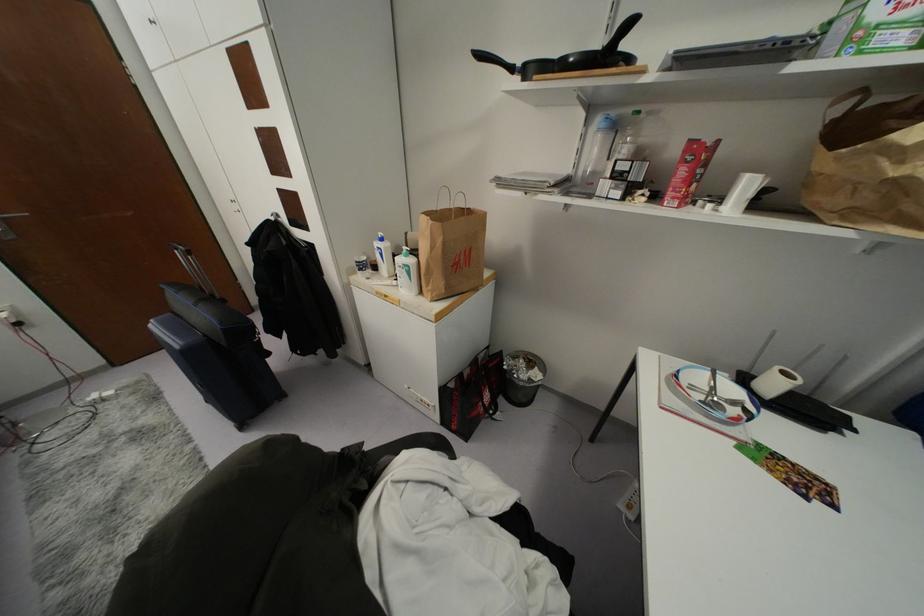
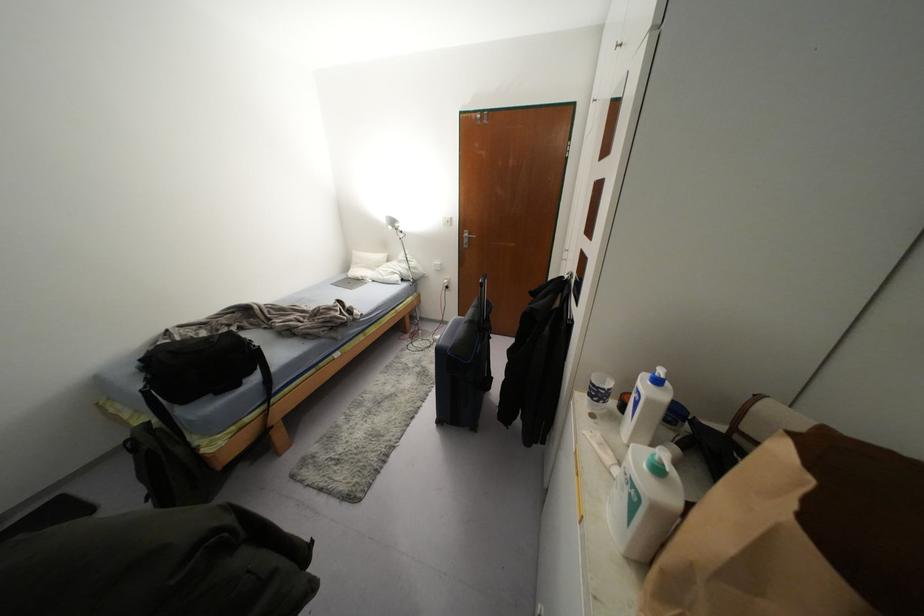
Where in the second image is the point corresponding to point 381,238 from the first image?

(658, 381)